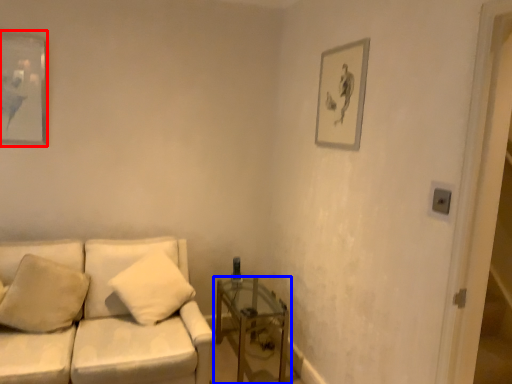
Question: Among these objects, which one is farthest to the camera, picture frame (highlighted by a red box) or table (highlighted by a blue box)?

Choices:
 (A) picture frame
 (B) table

Answer: (A)